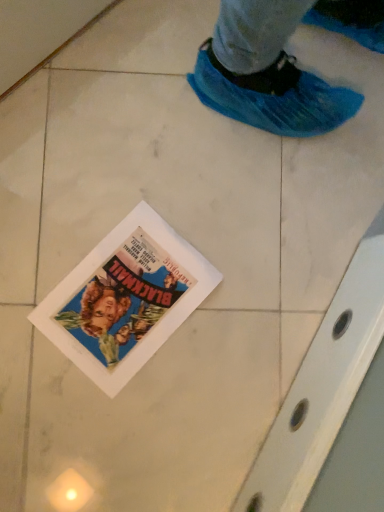
Where is `free point above white paper at center (from a real-world perspective)`? The height and width of the screenshot is (512, 384). free point above white paper at center (from a real-world perspective) is located at coordinates (125, 295).